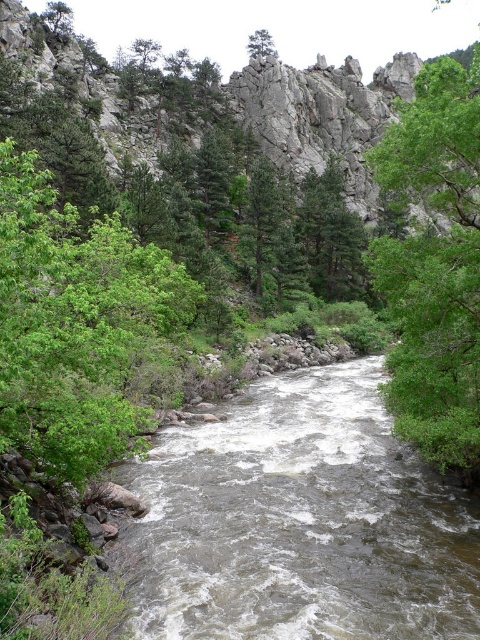
Question: Which point appears closest to the camera in this image?

Choices:
 (A) (389, 545)
 (B) (425, 72)
 (C) (119, 224)
 (D) (379, 116)

Answer: (A)

Question: Is the position of green leafy tree at left less distant than that of gray rock at center?

Choices:
 (A) no
 (B) yes

Answer: (B)

Question: Among these points, which one is nearest to the camera?

Choices:
 (A) (302, 138)
 (B) (445, 163)
 (C) (361, 424)
 (D) (36, 374)

Answer: (D)

Question: Is brown/rocky stream at center below gray rock at center?

Choices:
 (A) no
 (B) yes

Answer: (B)

Question: Which object is farther from the camera taking this photo?

Choices:
 (A) green matte tree at upper center
 (B) gray rock at center

Answer: (A)

Question: Is green leafy tree at right to the right of green matte tree at upper center from the viewer's perspective?

Choices:
 (A) yes
 (B) no

Answer: (A)